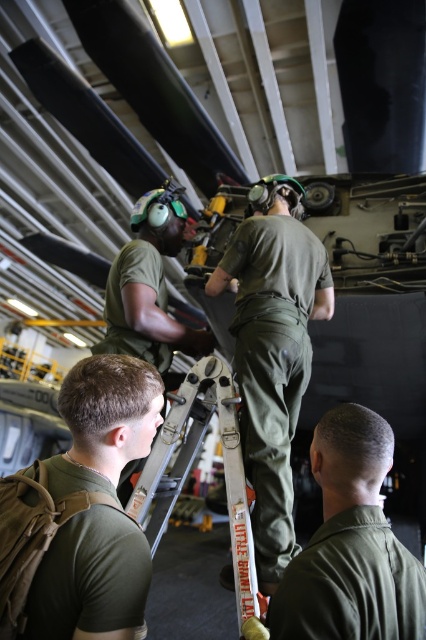
You are a maintenance technician standing at the camera position in the hangar. There is a point at coordinates (103, 476) that needs inspection. Can you reach it without moving more than 1 meter from your current position?

The point at (103, 476) is 1.06 meters away from the camera position, so you cannot reach it without moving more than 1 meter from your current position.